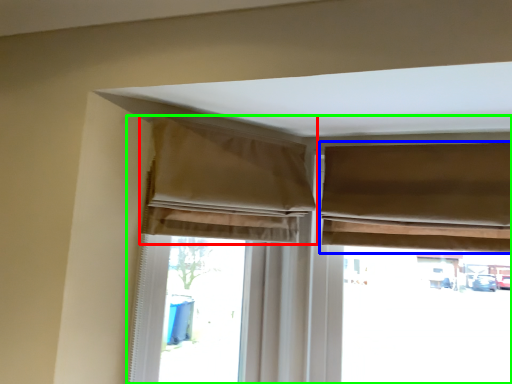
Question: Which is nearer to the curtain (highlighted by a red box)? curtain (highlighted by a blue box) or window (highlighted by a green box).

Choices:
 (A) curtain
 (B) window

Answer: (B)